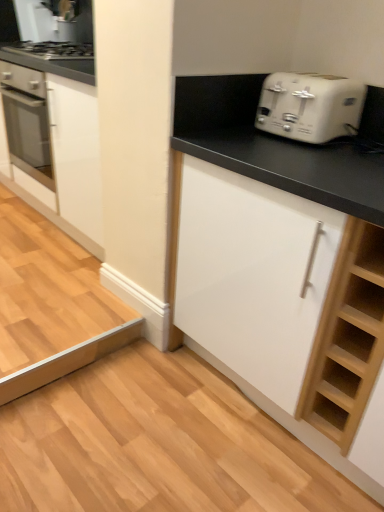
The height and width of the screenshot is (512, 384). What are the coordinates of `free space that is to the left of white plastic toaster at upper right` in the screenshot? It's located at (242, 137).